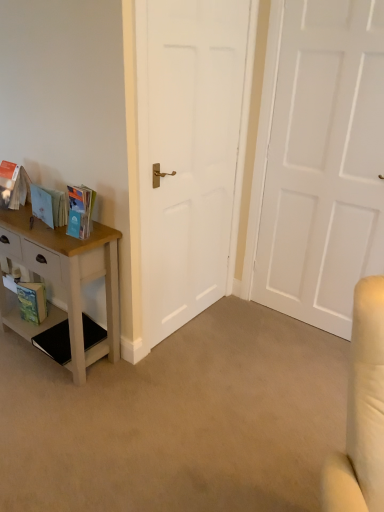
Question: Is point (269, 33) closer or farther from the camera than point (21, 314)?

Choices:
 (A) farther
 (B) closer

Answer: (B)

Question: From the image's perspective, relative to green matte paperback book at lower left, is white matte door at center, which appears as the 2th door when viewed from the left, above or below?

Choices:
 (A) below
 (B) above

Answer: (B)

Question: Which is farther from the wooden table at left?

Choices:
 (A) matte orange book at left, positioned as the first book in left-to-right order
 (B) white painted wood nightstand at left
 (C) matte blue book at left, positioned as the 1th book in right-to-left order
 (D) green matte paperback book at lower left
 (E) white matte door at center, which is counted as the 1th door, starting from the left

Answer: (A)

Question: Which is farther from the white painted wood nightstand at left?

Choices:
 (A) white matte door at center, the first door positioned from the right
 (B) matte orange book at left, positioned as the first book in left-to-right order
 (C) matte cardboard book at left, the second book positioned from the right
 (D) wooden table at left
 (E) white matte door at center, which appears as the second door when viewed from the right

Answer: (A)